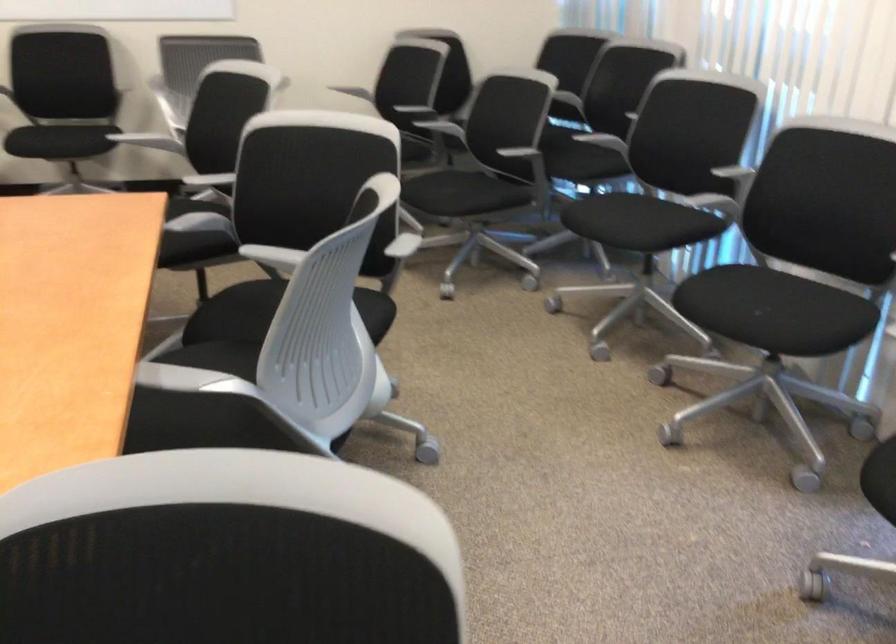
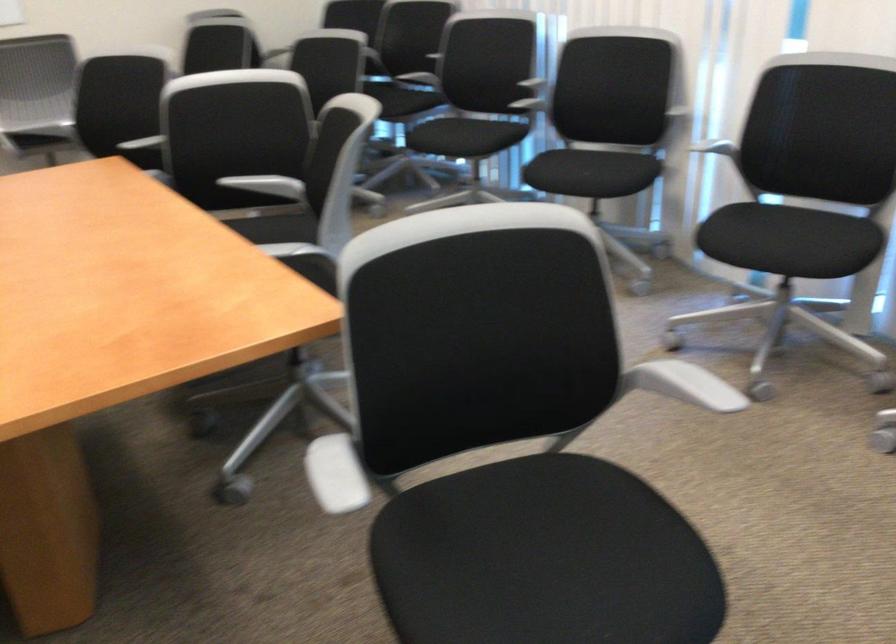
The point at (x=755, y=312) is marked in the first image. Where is the corresponding point in the second image?

(587, 174)